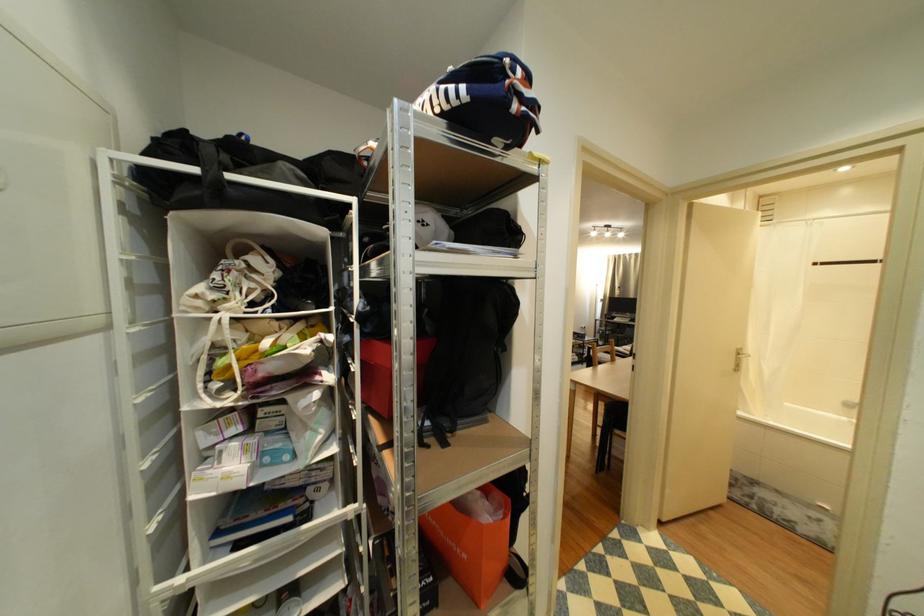
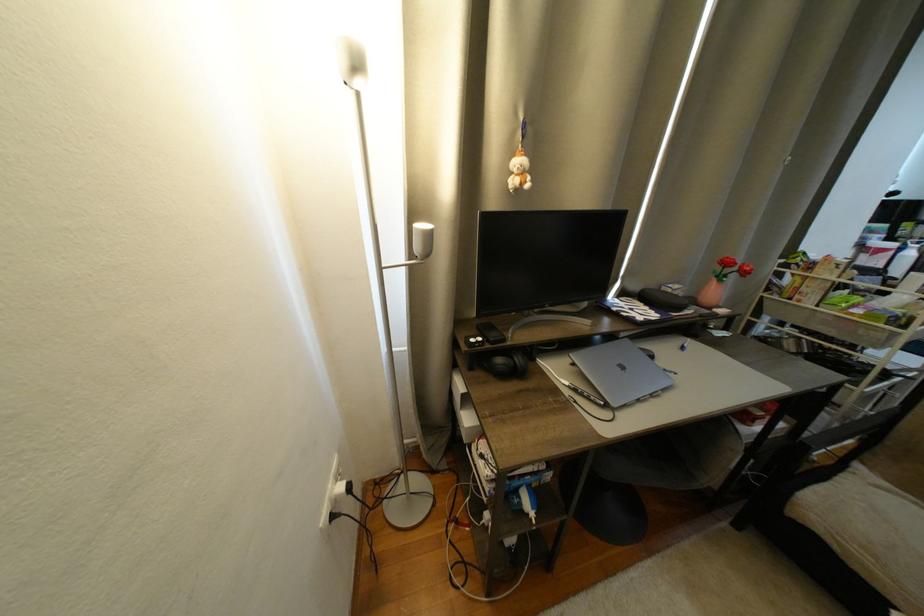
Where in the second image is the point corresponding to [590,328] from the first image?

(333, 520)